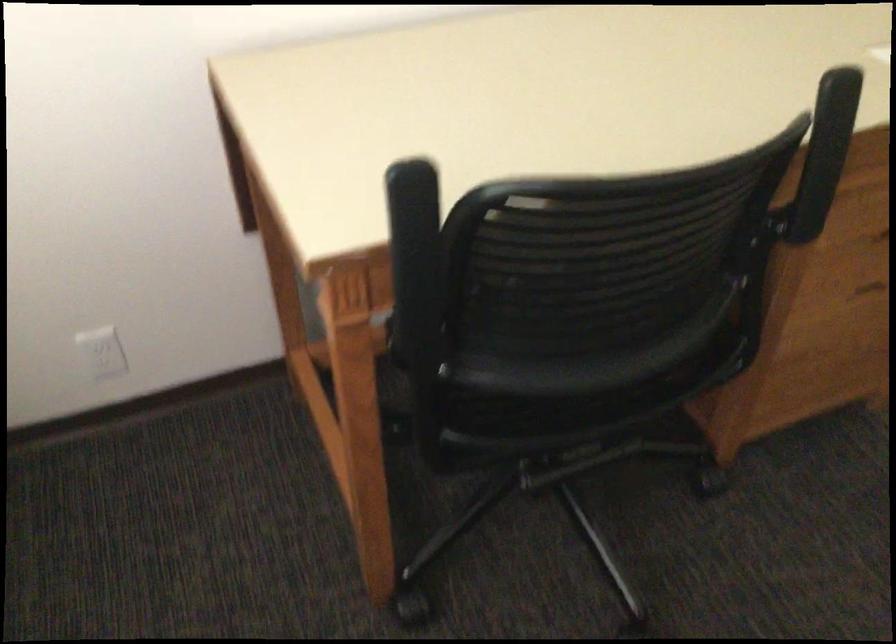
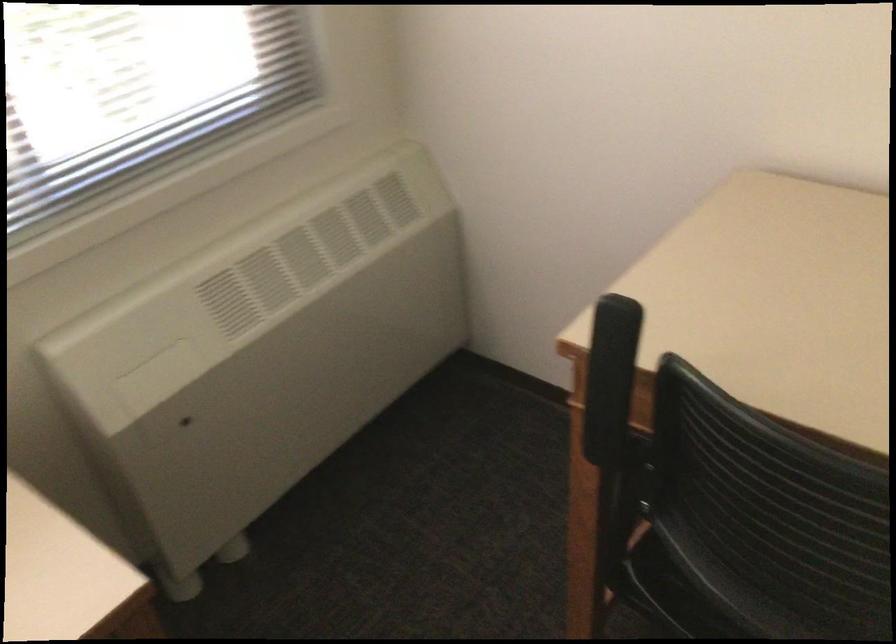
Question: Based on the continuous images, in which direction is the camera rotating? Reply with the corresponding letter.

Choices:
 (A) Left
 (B) Right
 (C) Up
 (D) Down

Answer: (A)